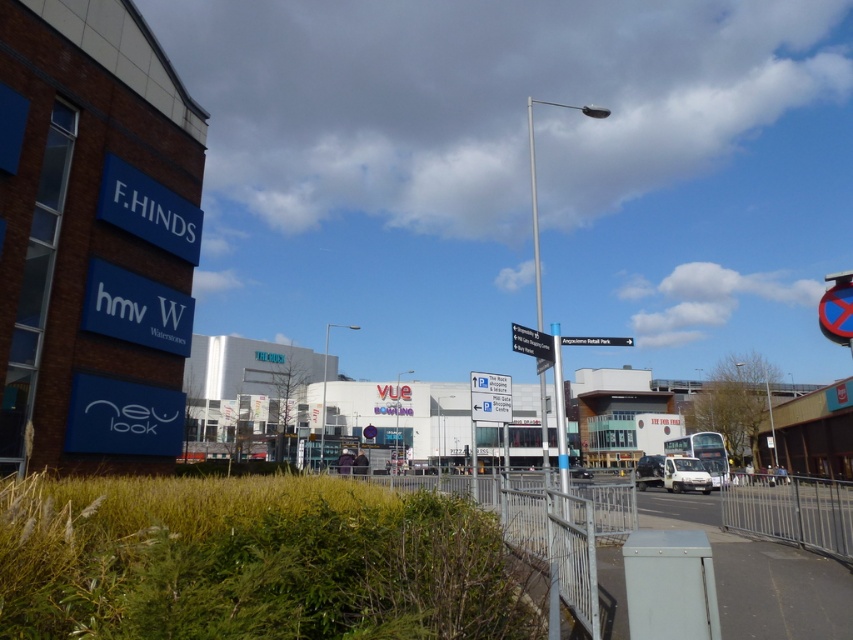
You are standing at the point labeled point (532, 342) in the image. What object is directly in front of you?

The metallic rectangular sign at center is directly in front of you at point (532, 342).

You are standing on a pedestrian walkway and want to take a photo of both the Vue Cinema sign and the New Look store. You notice two points marked in the scene. Which point, point (517, 346) or point (656, 483), is closer to you and would allow you to capture both landmarks in focus without moving your camera position?

Point (517, 346) is closer to the camera than point (656, 483), so choosing this point would help you capture both landmarks in focus as it is nearer to your current position.